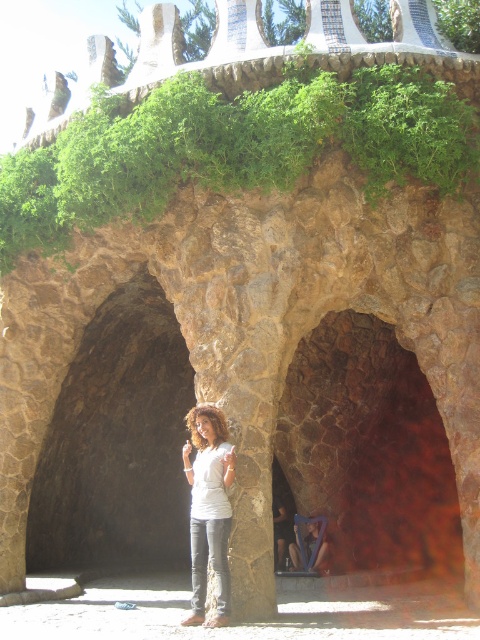
Is rustic stone arch at center taller than white matte shirt at center?

Correct, rustic stone arch at center is much taller as white matte shirt at center.

From the picture: Can you confirm if rustic stone arch at center is wider than white matte shirt at center?

Yes, rustic stone arch at center is wider than white matte shirt at center.

Between point (384, 528) and point (232, 470), which one is positioned in front?

Point (232, 470) is in front.

At what (x,y) coordinates should I click in order to perform the action: click on rustic stone arch at center. Please return your answer as a coordinate pair (x, y). The width and height of the screenshot is (480, 640). Looking at the image, I should click on (369, 449).